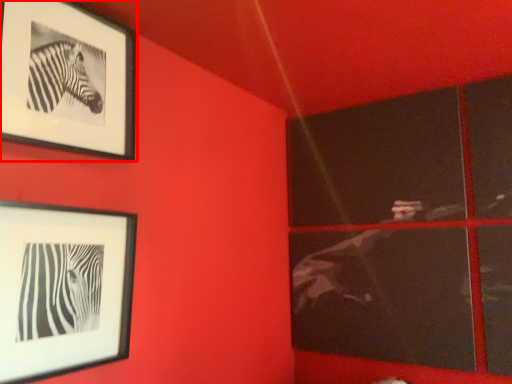
Question: From the image, what is the correct spatial relationship of picture frame (annotated by the red box) in relation to picture frame?

Choices:
 (A) left
 (B) right

Answer: (A)